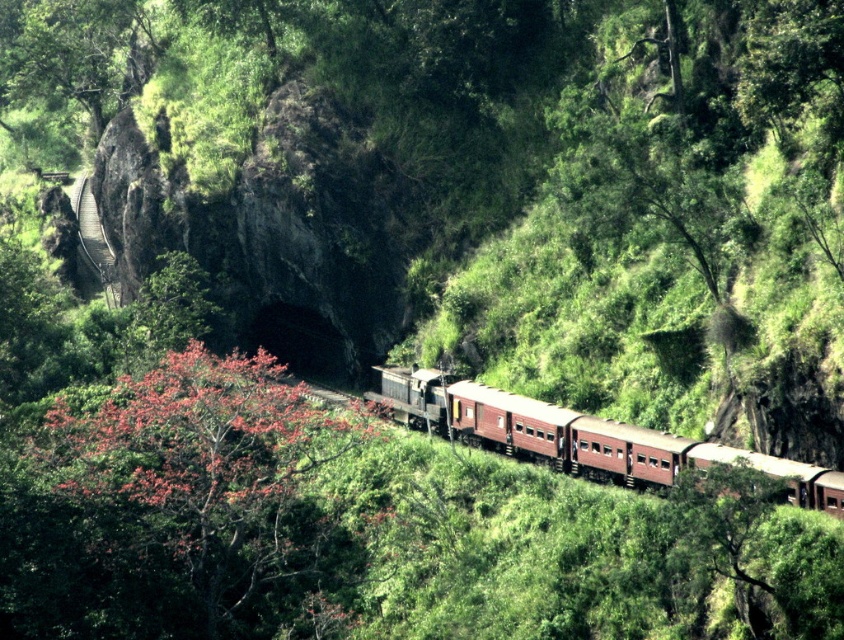
Who is taller, fluffy pink blossoms at center or green leafy tree at upper left?

green leafy tree at upper left

Locate an element on the screen. fluffy pink blossoms at center is located at coordinates (212, 477).

Which is above, matte brown train at center or green leafy tree at upper left?

green leafy tree at upper left is above.

Is matte brown train at center further to camera compared to green leafy tree at upper left?

No.

Find the location of a particular element. matte brown train at center is located at coordinates (582, 436).

This screenshot has width=844, height=640. I want to click on matte brown train at center, so click(x=582, y=436).

Does point (247, 509) lie behind point (793, 465)?

That is True.

Which is more to the left, fluffy pink blossoms at center or matte brown train at center?

fluffy pink blossoms at center

Measure the distance between point (303, 532) and camera.

Point (303, 532) and camera are 71.90 meters apart from each other.

You are a GUI agent. You are given a task and a screenshot of the screen. Output one action in this format:
    pyautogui.click(x=<x>, y=<y>)
    Task: Click on the fluffy pink blossoms at center
    
    Given the screenshot: What is the action you would take?
    pyautogui.click(x=212, y=477)